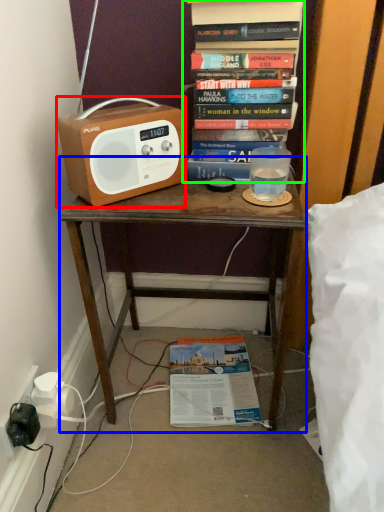
Question: Which object is positioned farthest from cassette (highlighted by a red box)? Select from desk (highlighted by a blue box) and book (highlighted by a green box).

Choices:
 (A) desk
 (B) book

Answer: (A)